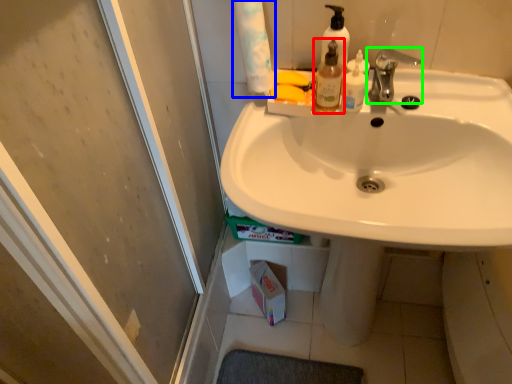
Question: Which object is positioned closest to mouthwash (highlighted by a red box)? Select from toilet paper (highlighted by a blue box) and tap (highlighted by a green box).

Choices:
 (A) toilet paper
 (B) tap

Answer: (B)